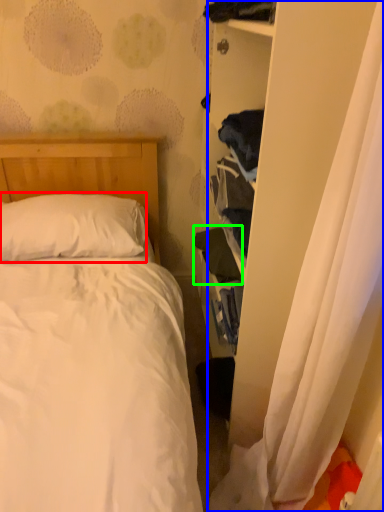
Question: Which object is positioned farthest from pillow (highlighted by a red box)? Select from curtain (highlighted by a blue box) and clothing (highlighted by a green box).

Choices:
 (A) curtain
 (B) clothing

Answer: (A)